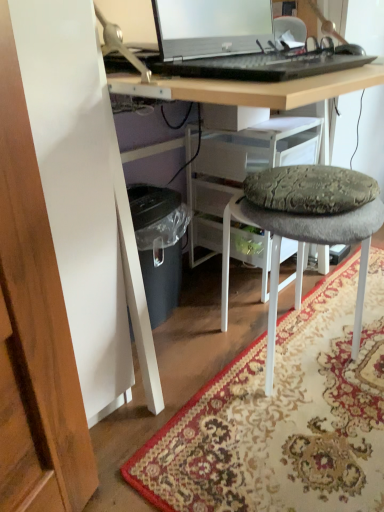
Question: Is textured gray cushioned stool at center spatially inside patterned carpet at lower center, or outside of it?

Choices:
 (A) inside
 (B) outside

Answer: (B)

Question: From a real-world perspective, is textured gray cushioned stool at center physically located above or below patterned carpet at lower center?

Choices:
 (A) above
 (B) below

Answer: (A)

Question: Which of these objects is positioned farthest from the textured gray cushioned stool at center?

Choices:
 (A) sleek silver laptop at upper center
 (B) patterned carpet at lower center

Answer: (A)

Question: Estimate the real-world distances between objects in this image. Which object is closer to the sleek silver laptop at upper center?

Choices:
 (A) patterned carpet at lower center
 (B) textured gray cushioned stool at center

Answer: (B)